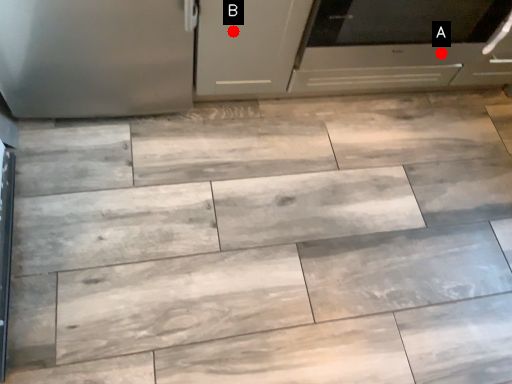
Question: Two points are circled on the image, labeled by A and B beside each circle. Which of the following is the farthest from the observer?

Choices:
 (A) A is further
 (B) B is further

Answer: (A)